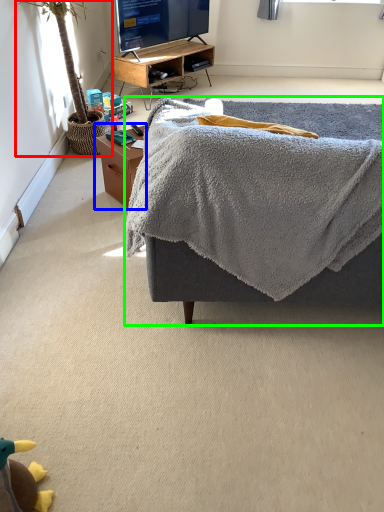
Question: Which object is the closest to the houseplant (highlighted by a red box)? Choose among these: table (highlighted by a blue box) or furniture (highlighted by a green box).

Choices:
 (A) table
 (B) furniture

Answer: (A)